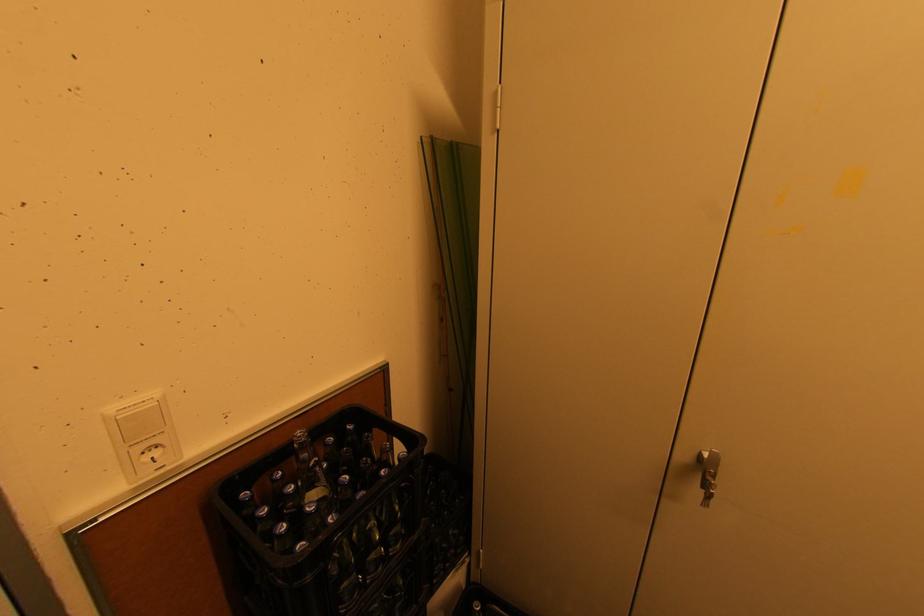
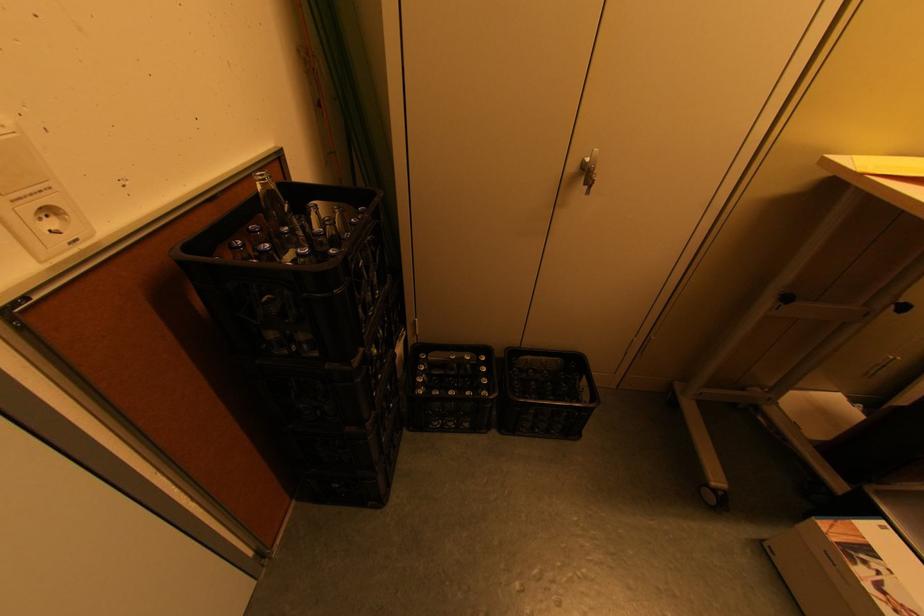
Where in the second image is the point corresponding to pixel 166 434 from the first image?

(54, 188)